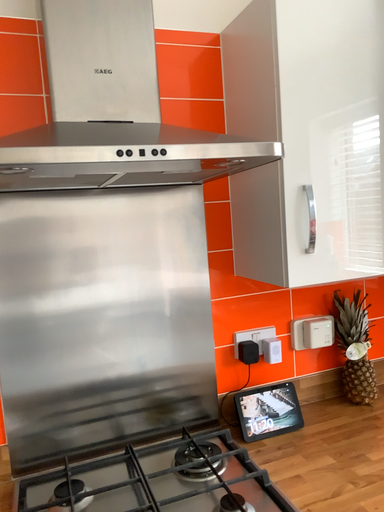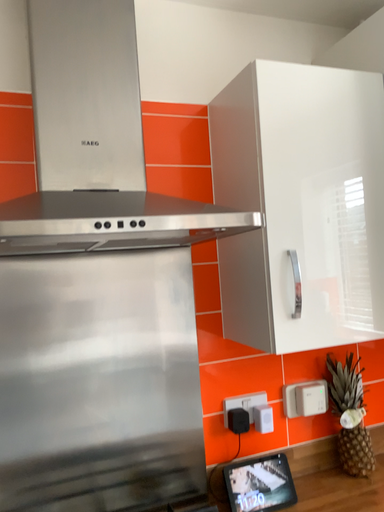
Question: Which way did the camera rotate in the video?

Choices:
 (A) rotated downward
 (B) rotated upward

Answer: (B)